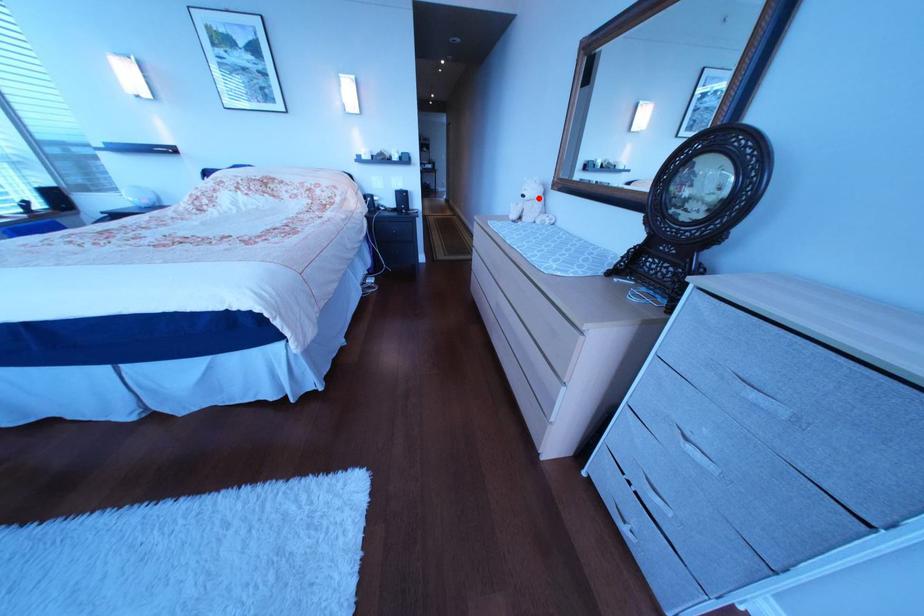
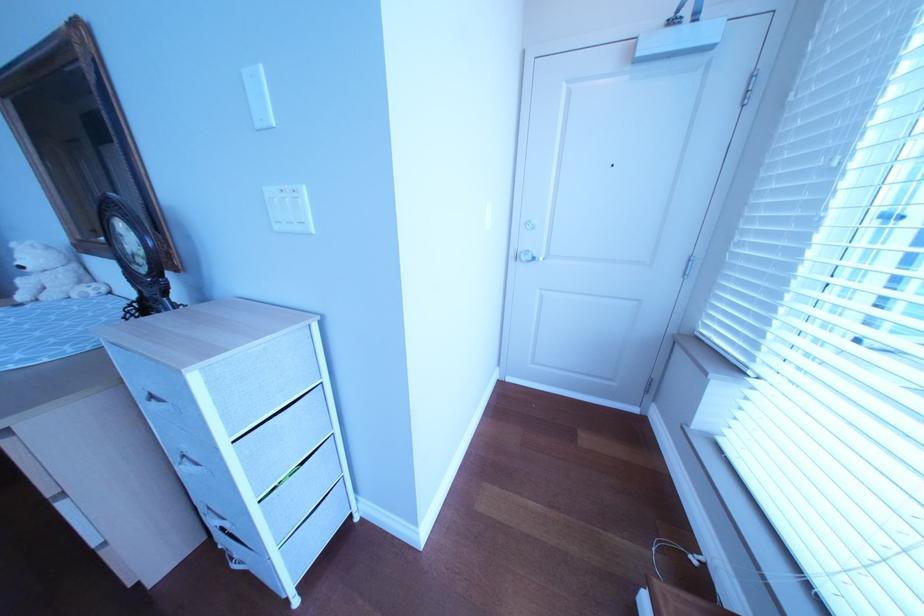
Locate, in the second image, the point that corresponds to the highlighted location in the first image.

(37, 270)